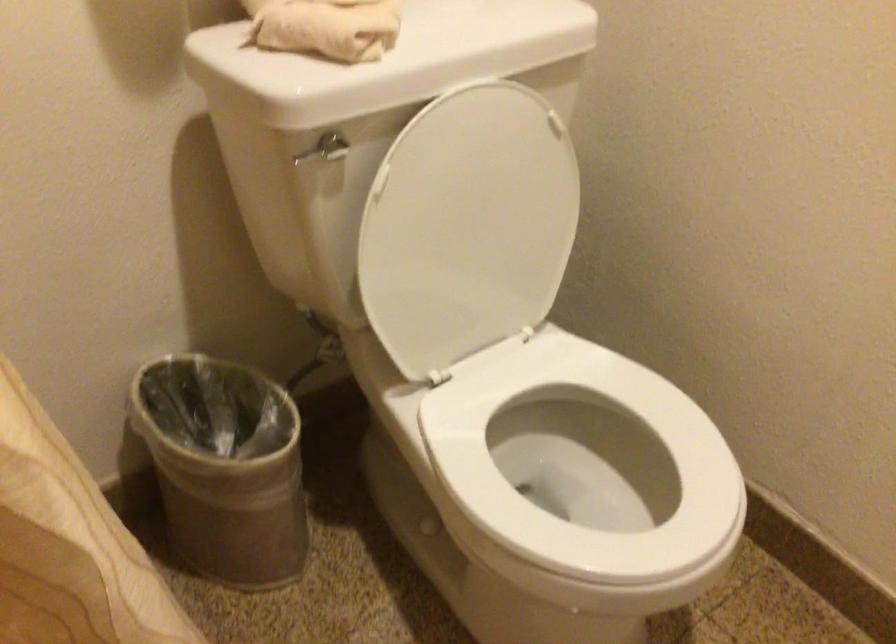
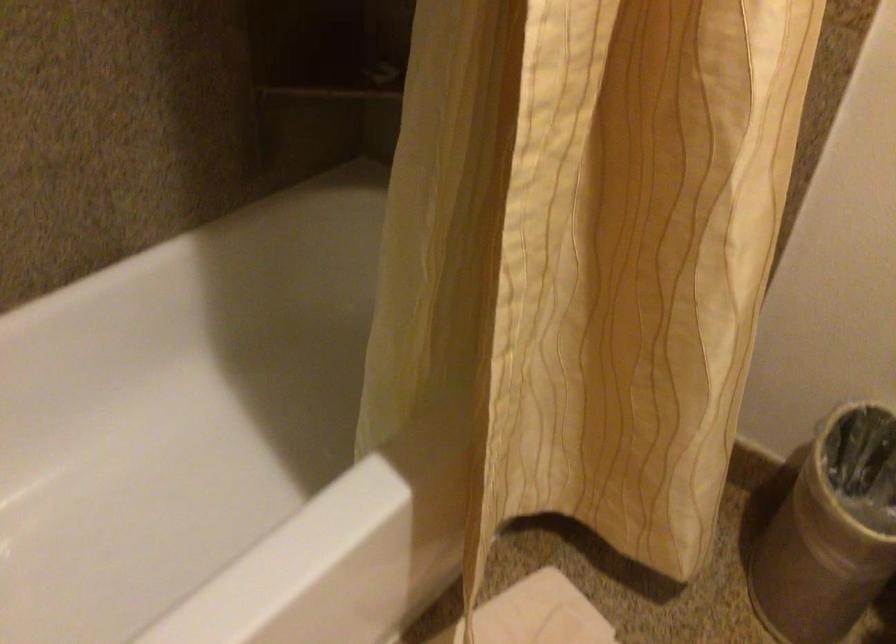
The images are taken continuously from a first-person perspective. In which direction is your viewpoint rotating?

The camera rotated toward left-down.